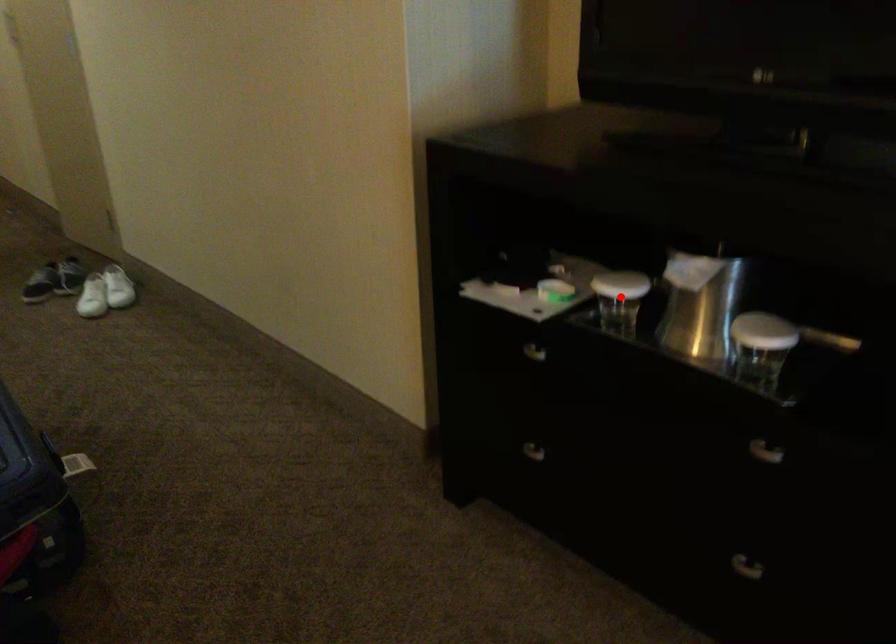
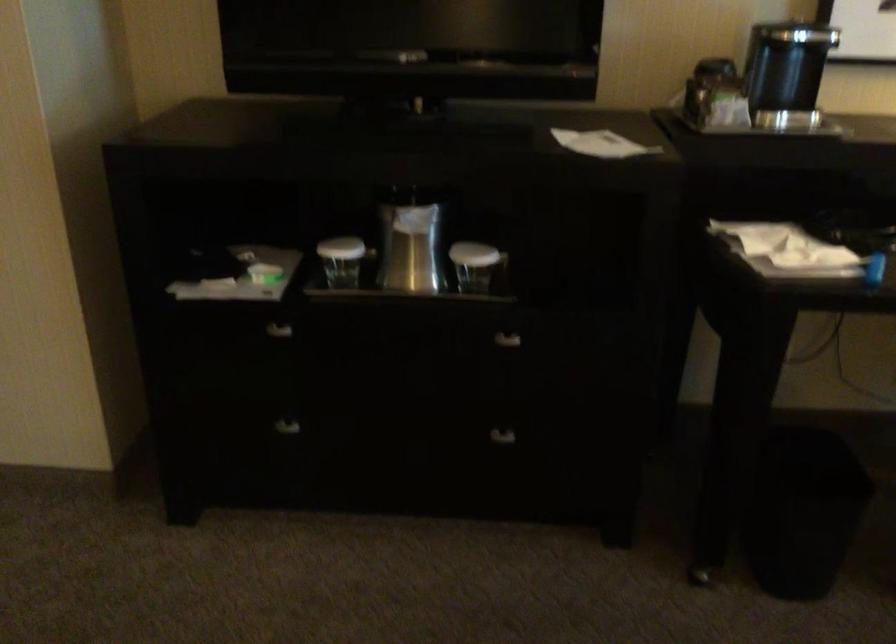
Locate, in the second image, the point that corresponds to the highlighted location in the first image.

(341, 261)